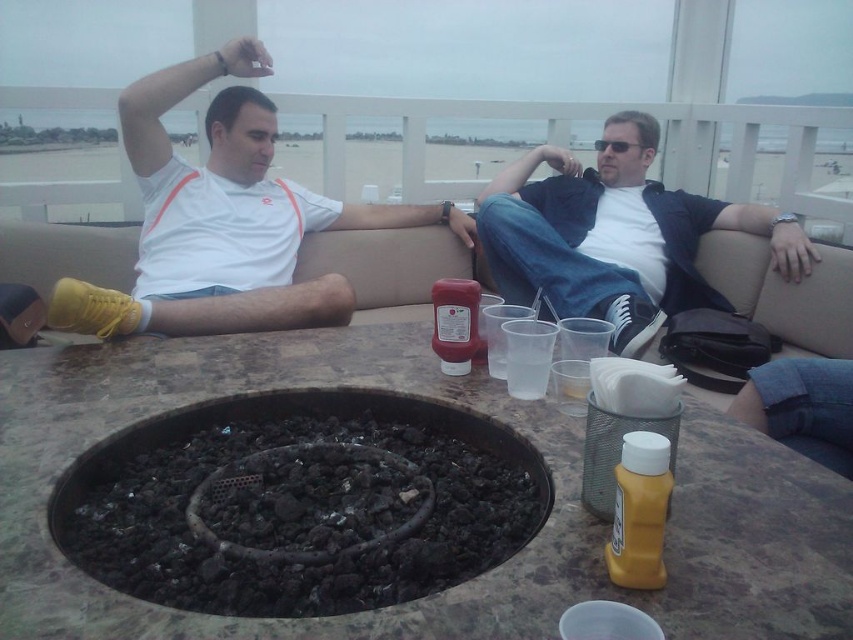
You are standing on the balcony and need to place a small potted plant between the charcoal ash fire pit at center and the matte black jacket at center. Which object should the plant be closer to if it needs to be placed at a lower elevation?

The plant should be placed closer to the charcoal ash fire pit at center because it has a lesser height compared to the matte black jacket at center, allowing the plant to be at a lower elevation.